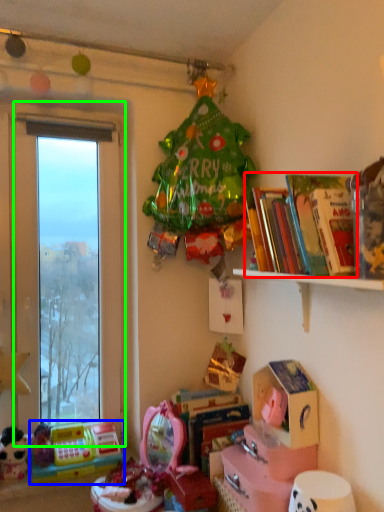
Question: Considering the real-world distances, which object is closest to book (highlighted by a red box)? toy (highlighted by a blue box) or window (highlighted by a green box).

Choices:
 (A) toy
 (B) window

Answer: (B)